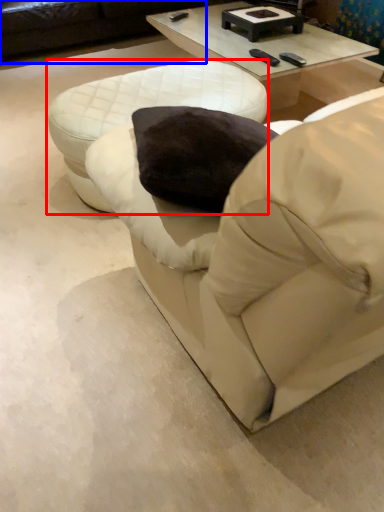
Question: Which of the following is the closest to the observer, table (highlighted by a red box) or studio couch (highlighted by a blue box)?

Choices:
 (A) table
 (B) studio couch

Answer: (A)